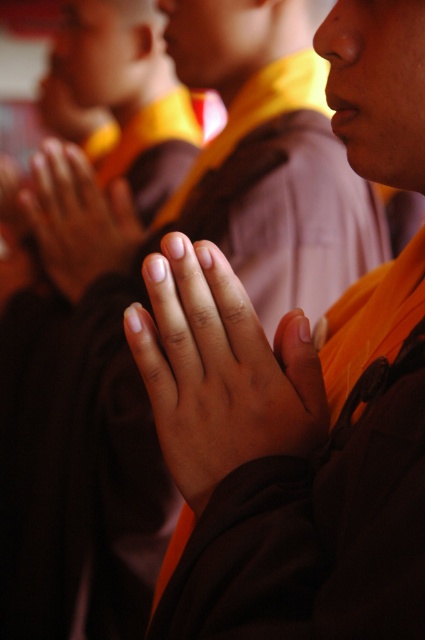
Question: Which of the following is the farthest from the observer?

Choices:
 (A) (243, 339)
 (B) (42, 202)

Answer: (B)

Question: Considering the relative positions of smooth skin hands at center and matte orange cloth at center in the image provided, where is smooth skin hands at center located with respect to matte orange cloth at center?

Choices:
 (A) above
 (B) below

Answer: (B)

Question: Is smooth skin hands at center smaller than matte orange cloth at center?

Choices:
 (A) yes
 (B) no

Answer: (A)

Question: Is smooth skin hands at center bigger than matte orange cloth at center?

Choices:
 (A) yes
 (B) no

Answer: (B)